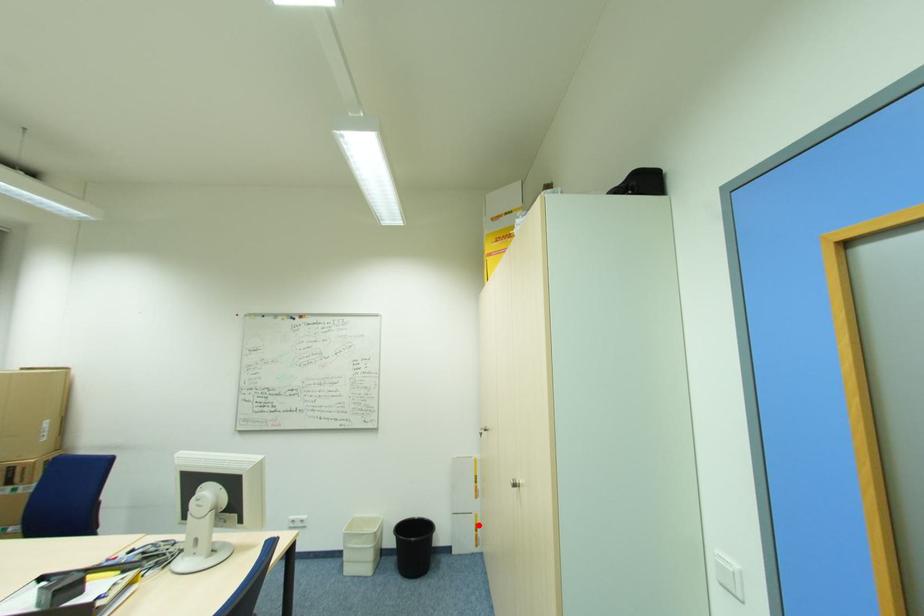
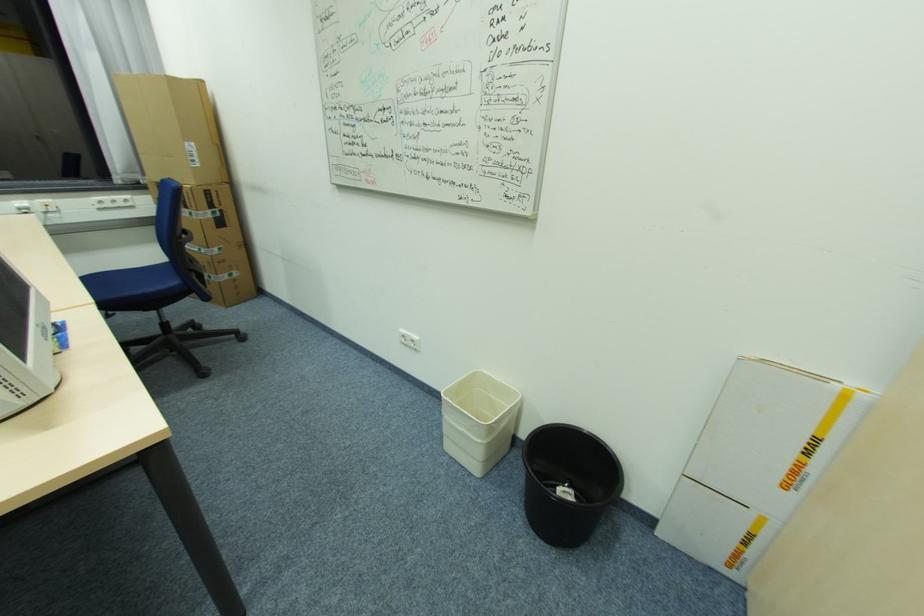
The point at the highlighted location is marked in the first image. Where is the corresponding point in the second image?

(752, 535)